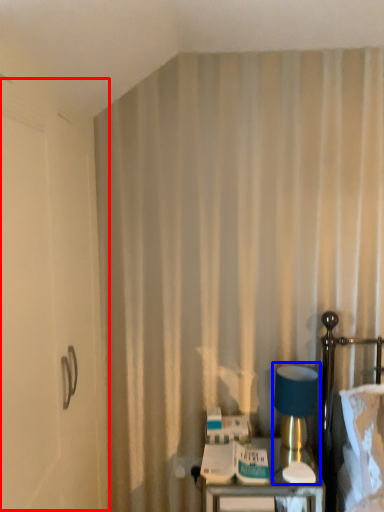
Question: Which object is further to the camera taking this photo, screen door (highlighted by a red box) or table lamp (highlighted by a blue box)?

Choices:
 (A) screen door
 (B) table lamp

Answer: (B)